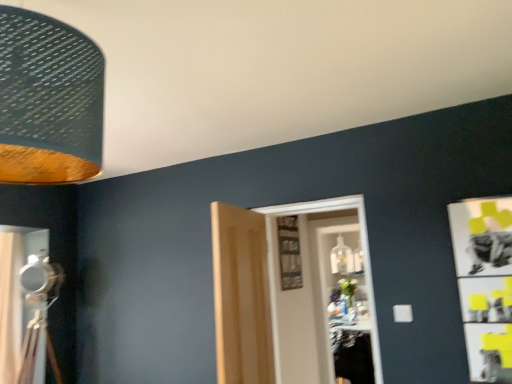
Question: From the image's perspective, is light wood paneling at center, the second door from the right, below white wooden door at center, which is the 1th door in right-to-left order?

Choices:
 (A) yes
 (B) no

Answer: (B)

Question: From a real-world perspective, is light wood paneling at center, the second door from the right, on top of white wooden door at center, which is the 1th door in right-to-left order?

Choices:
 (A) no
 (B) yes

Answer: (A)

Question: Would you say light wood paneling at center, the 1th door positioned from the left, contains white wooden door at center, which is the 1th door in right-to-left order?

Choices:
 (A) yes
 (B) no

Answer: (B)

Question: Considering the relative sizes of light wood paneling at center, the second door from the right, and white wooden door at center, arranged as the 2th door when viewed from the left, in the image provided, is light wood paneling at center, the second door from the right, smaller than white wooden door at center, arranged as the 2th door when viewed from the left,?

Choices:
 (A) yes
 (B) no

Answer: (A)

Question: Considering the relative positions of light wood paneling at center, the second door from the right, and white wooden door at center, which is the 1th door in right-to-left order, in the image provided, is light wood paneling at center, the second door from the right, to the left of white wooden door at center, which is the 1th door in right-to-left order, from the viewer's perspective?

Choices:
 (A) yes
 (B) no

Answer: (A)

Question: In terms of height, does white wooden door at center, which is the 1th door in right-to-left order, look taller or shorter compared to light wood paneling at center, the second door from the right?

Choices:
 (A) tall
 (B) short

Answer: (A)

Question: From a real-world perspective, is white wooden door at center, arranged as the 2th door when viewed from the left, above or below light wood paneling at center, the second door from the right?

Choices:
 (A) below
 (B) above

Answer: (B)

Question: Considering the positions of white wooden door at center, which is the 1th door in right-to-left order, and light wood paneling at center, the second door from the right, in the image, is white wooden door at center, which is the 1th door in right-to-left order, bigger or smaller than light wood paneling at center, the second door from the right,?

Choices:
 (A) small
 (B) big

Answer: (B)

Question: Considering the positions of point (268, 291) and point (253, 336), is point (268, 291) closer or farther from the camera than point (253, 336)?

Choices:
 (A) closer
 (B) farther

Answer: (B)

Question: Visually, is light wood paneling at center, the 1th door positioned from the left, positioned to the left or to the right of metallic silver tripod at left?

Choices:
 (A) right
 (B) left

Answer: (A)

Question: From the image's perspective, is light wood paneling at center, the second door from the right, located above or below metallic silver tripod at left?

Choices:
 (A) above
 (B) below

Answer: (A)

Question: Relative to metallic silver tripod at left, is light wood paneling at center, the 1th door positioned from the left, in front or behind?

Choices:
 (A) front
 (B) behind

Answer: (A)

Question: Considering the positions of light wood paneling at center, the 1th door positioned from the left, and metallic silver tripod at left in the image, is light wood paneling at center, the 1th door positioned from the left, bigger or smaller than metallic silver tripod at left?

Choices:
 (A) small
 (B) big

Answer: (A)

Question: Would you say metallic silver tripod at left is inside or outside matte silver curtain at left?

Choices:
 (A) inside
 (B) outside

Answer: (B)

Question: In terms of height, does metallic silver tripod at left look taller or shorter compared to matte silver curtain at left?

Choices:
 (A) short
 (B) tall

Answer: (A)